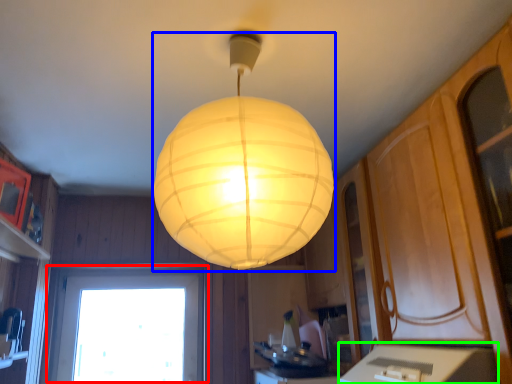
Question: Considering the real-world distances, which object is closest to window (highlighted by a red box)? lamp (highlighted by a blue box) or counter top (highlighted by a green box).

Choices:
 (A) lamp
 (B) counter top

Answer: (B)